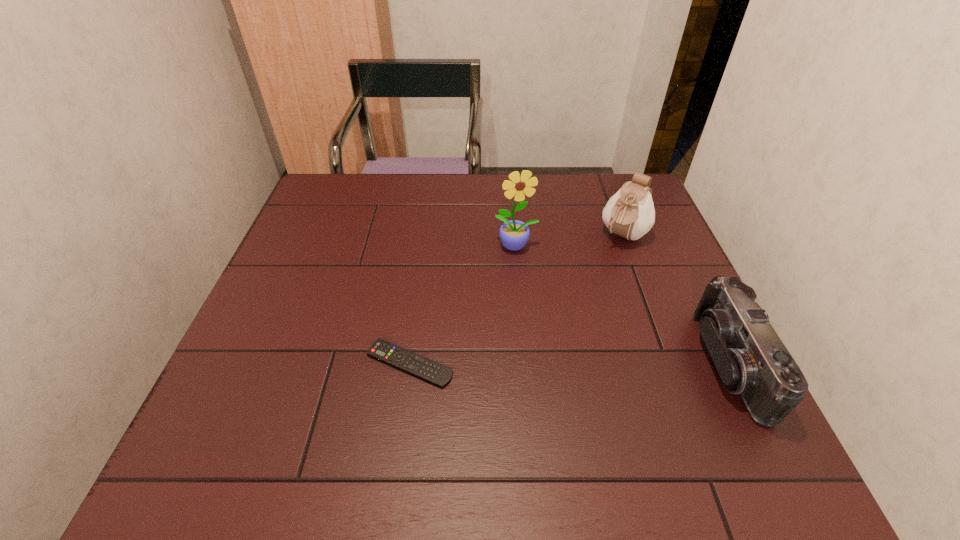
Where is `blank space located 0.350m on the front-facing side of the rightmost object`? Image resolution: width=960 pixels, height=540 pixels. blank space located 0.350m on the front-facing side of the rightmost object is located at coordinates (537, 363).

You are a GUI agent. You are given a task and a screenshot of the screen. Output one action in this format:
    pyautogui.click(x=<x>, y=<y>)
    Task: Click on the blank space located on the front-facing side of the rightmost object
    The width and height of the screenshot is (960, 540).
    Given the screenshot: What is the action you would take?
    pyautogui.click(x=613, y=363)

Locate an element on the screen. The image size is (960, 540). vacant space situated 0.290m on the front-facing side of the third shortest object is located at coordinates (564, 316).

Locate an element on the screen. vacant space located on the front-facing side of the third shortest object is located at coordinates (559, 324).

The height and width of the screenshot is (540, 960). In order to click on vacant space located 0.120m on the front-facing side of the third shortest object in this screenshot , I will do `click(595, 274)`.

The width and height of the screenshot is (960, 540). What are the coordinates of `vacant space situated 0.120m on the front-facing side of the sunflower` in the screenshot? It's located at (530, 288).

The height and width of the screenshot is (540, 960). In order to click on vacant region located on the front-facing side of the sunflower in this screenshot , I will do `click(546, 342)`.

Where is `free location located 0.060m on the front-facing side of the sunflower`? The width and height of the screenshot is (960, 540). free location located 0.060m on the front-facing side of the sunflower is located at coordinates (524, 271).

Identify the location of remote control located at the near edge. (439, 375).

Find the location of a particular element. camcorder at the near edge is located at coordinates (751, 359).